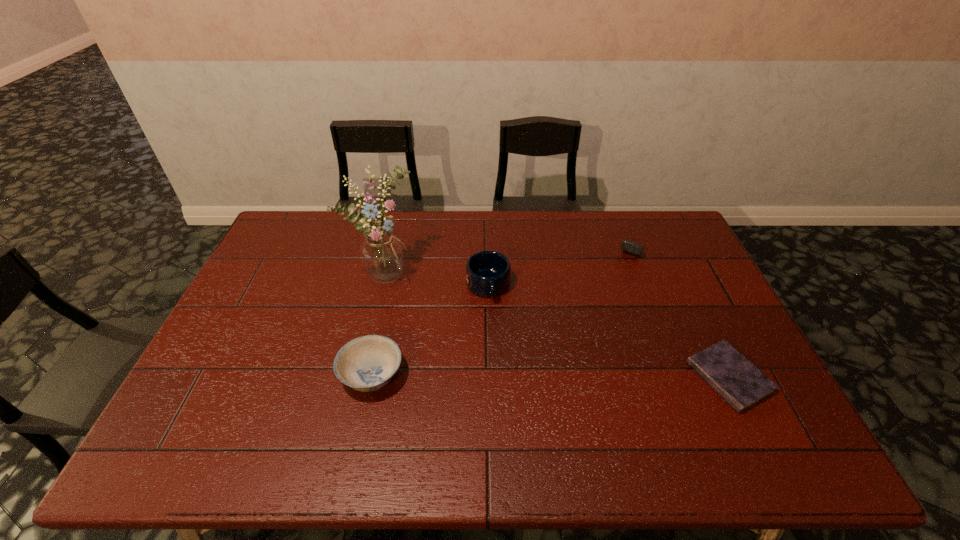
Where is `free space at the near right corner of the desktop`? free space at the near right corner of the desktop is located at coordinates (774, 411).

You are a GUI agent. You are given a task and a screenshot of the screen. Output one action in this format:
    pyautogui.click(x=<x>, y=<y>)
    Task: Click on the vacant area between the webcam and the third tallest object
    
    Given the screenshot: What is the action you would take?
    504,308

The image size is (960, 540). What are the coordinates of `vacant space that's between the shortest object and the mug` in the screenshot? It's located at (609, 332).

Where is `free space between the shortest object and the fourth shortest object`? Image resolution: width=960 pixels, height=540 pixels. free space between the shortest object and the fourth shortest object is located at coordinates (609, 332).

The width and height of the screenshot is (960, 540). In order to click on free space between the third shortest object and the fourth tallest object in this screenshot , I will do [x=504, y=308].

This screenshot has height=540, width=960. I want to click on vacant area that lies between the bouquet and the second tallest object, so click(436, 280).

Locate an element on the screen. The width and height of the screenshot is (960, 540). vacant point located between the shortest object and the third object from left to right is located at coordinates (609, 332).

In order to click on vacant point located between the fourth tallest object and the bowl in this screenshot , I will do `click(504, 308)`.

I want to click on empty space between the bouquet and the diary, so click(x=557, y=325).

At what (x,y) coordinates should I click in order to perform the action: click on blank region between the fourth tallest object and the second tallest object. Please return your answer as a coordinate pair (x, y). Looking at the image, I should click on (563, 264).